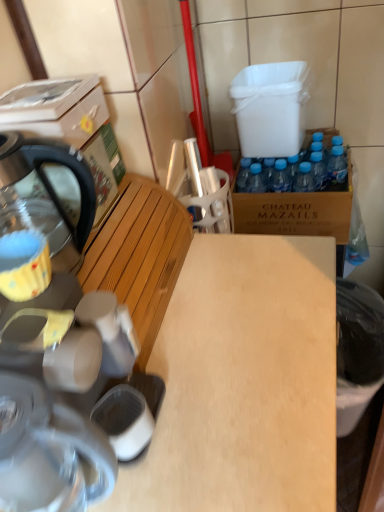
Locate an element on the screen. free space that is in between matte gray coffee machine at lower left and wooden bench at left is located at coordinates (175, 319).